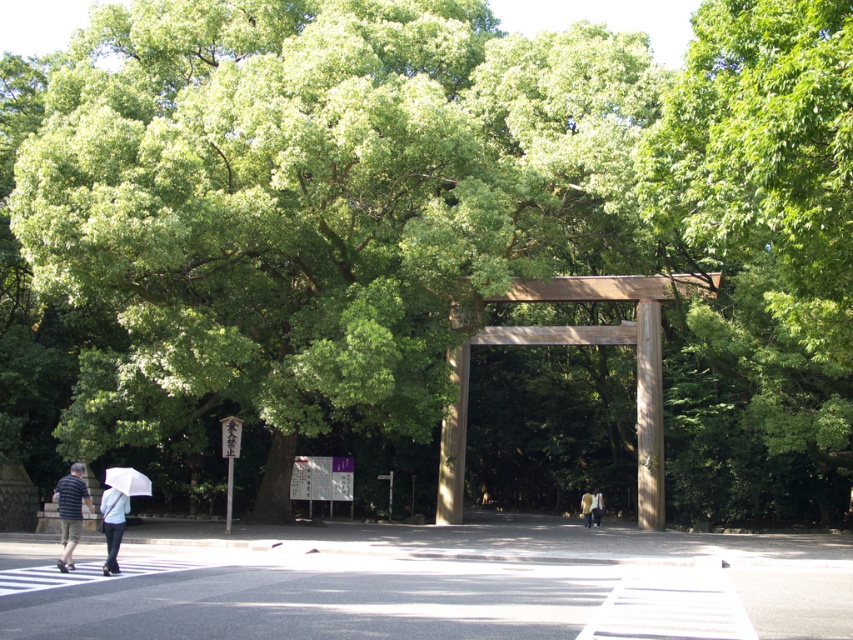
Question: Which object appears farthest from the camera in this image?

Choices:
 (A) yellow-green fabric umbrella at center
 (B) light blue fabric jacket at lower left
 (C) matte white umbrella at lower left
 (D) white matte umbrella at lower left

Answer: (A)

Question: Does light blue fabric jacket at lower left appear on the left side of yellow-green fabric umbrella at center?

Choices:
 (A) yes
 (B) no

Answer: (A)

Question: Can you confirm if wooden torii gate at center is positioned to the left of white matte umbrella at lower left?

Choices:
 (A) yes
 (B) no

Answer: (B)

Question: Which object is closer to the camera taking this photo?

Choices:
 (A) matte white umbrella at lower left
 (B) yellow-green fabric umbrella at center

Answer: (A)

Question: Among these points, which one is nearest to the camera?

Choices:
 (A) (112, 566)
 (B) (585, 502)
 (C) (654, 356)

Answer: (A)

Question: Does wooden torii gate at center appear under matte white umbrella at lower left?

Choices:
 (A) no
 (B) yes

Answer: (A)